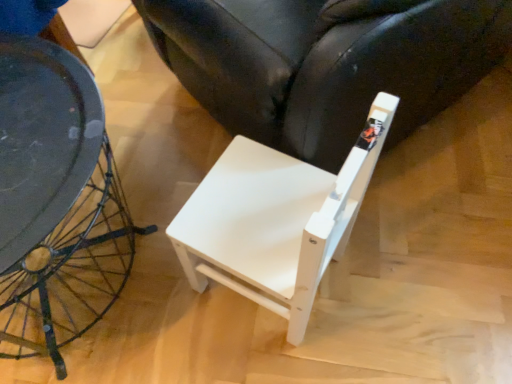
Image resolution: width=512 pixels, height=384 pixels. What are the coordinates of `free space to the right of white matte chair at center, the 1th chair from the bottom` in the screenshot? It's located at pos(388,276).